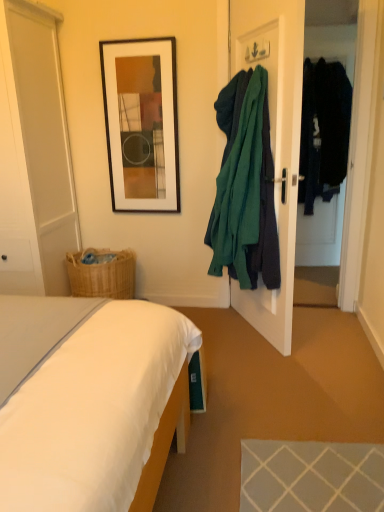
Question: Is teal fabric coat at right, positioned as the first clothing in front-to-back order, inside or outside of black matte picture frame at upper center?

Choices:
 (A) outside
 (B) inside

Answer: (A)

Question: In terms of size, does teal fabric coat at right, acting as the 2th clothing starting from the back, appear bigger or smaller than black matte picture frame at upper center?

Choices:
 (A) big
 (B) small

Answer: (A)

Question: Which object is positioned farthest from the teal fabric coat hanger at right?

Choices:
 (A) black matte picture frame at upper center
 (B) teal fabric coat at right, positioned as the first clothing in front-to-back order
 (C) white glossy door at left, placed as the first glass door when sorted from left to right
 (D) white fabric bed at lower left
 (E) dark blue fabric coat at right, marked as the first clothing in a back-to-front arrangement

Answer: (C)

Question: Considering the real-world distances, which object is farthest from the transparent glass door at right, marked as the 1th glass door in a right-to-left arrangement?

Choices:
 (A) dark blue fabric coat at right, marked as the 1th clothing in a right-to-left arrangement
 (B) black matte picture frame at upper center
 (C) white glossy door at left, placed as the first glass door when sorted from left to right
 (D) teal fabric coat at right, acting as the 2th clothing starting from the back
 (E) teal fabric coat hanger at right

Answer: (C)